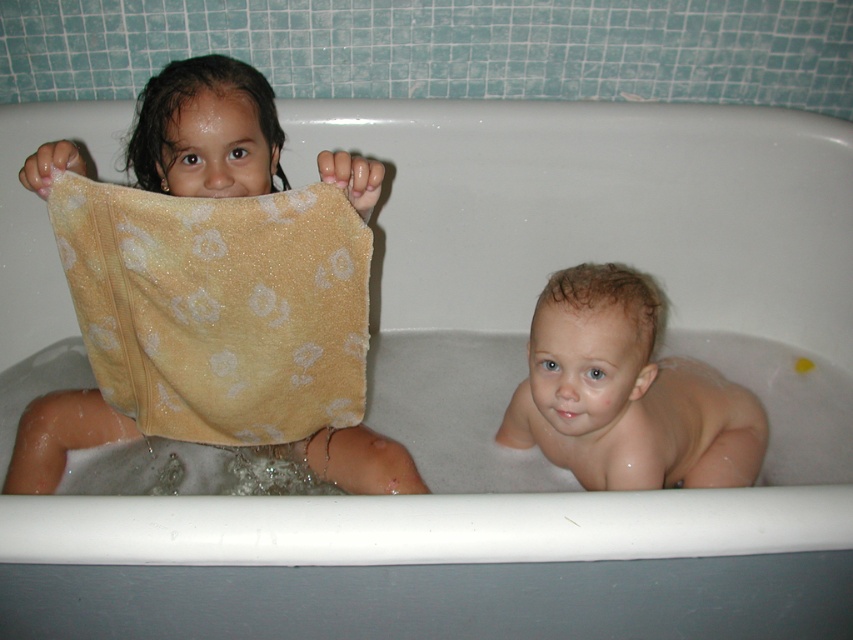
Can you confirm if yellow soft towel at upper left is bigger than yellow textured towel at left?

Incorrect, yellow soft towel at upper left is not larger than yellow textured towel at left.

Who is more distant from viewer, (102, 384) or (97, 426)?

The point (97, 426) is more distant.

Find the location of a particular element. The width and height of the screenshot is (853, 640). yellow soft towel at upper left is located at coordinates [219, 307].

Is light brown wet hair at lower right above yellow textured towel at left?

Actually, light brown wet hair at lower right is below yellow textured towel at left.

Consider the image. Which is below, light brown wet hair at lower right or yellow textured towel at left?

light brown wet hair at lower right

Who is more distant from viewer, (589, 440) or (381, 472)?

The point (589, 440) is behind.

Where is `light brown wet hair at lower right`? This screenshot has height=640, width=853. light brown wet hair at lower right is located at coordinates (625, 394).

Who is higher up, yellow soft towel at upper left or light brown wet hair at lower right?

Positioned higher is yellow soft towel at upper left.

Between point (170, 282) and point (735, 422), which one is positioned in front?

Point (170, 282) is more forward.

In order to click on yellow soft towel at upper left in this screenshot , I will do `click(219, 307)`.